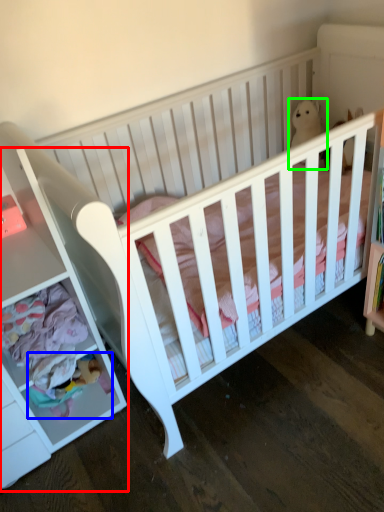
Question: Which is farther away from dresser (highlighted by a red box)? toy (highlighted by a blue box) or animal (highlighted by a green box)?

Choices:
 (A) toy
 (B) animal

Answer: (B)